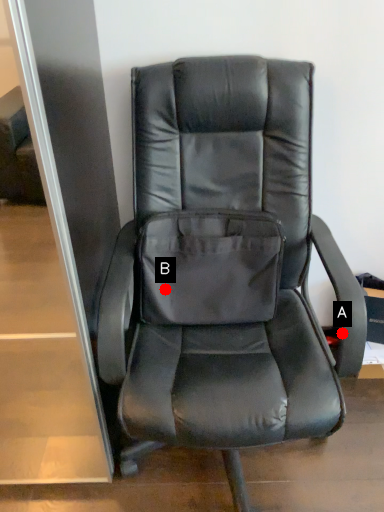
Question: Two points are circled on the image, labeled by A and B beside each circle. Which point is farther from the camera taking this photo?

Choices:
 (A) A is further
 (B) B is further

Answer: (B)